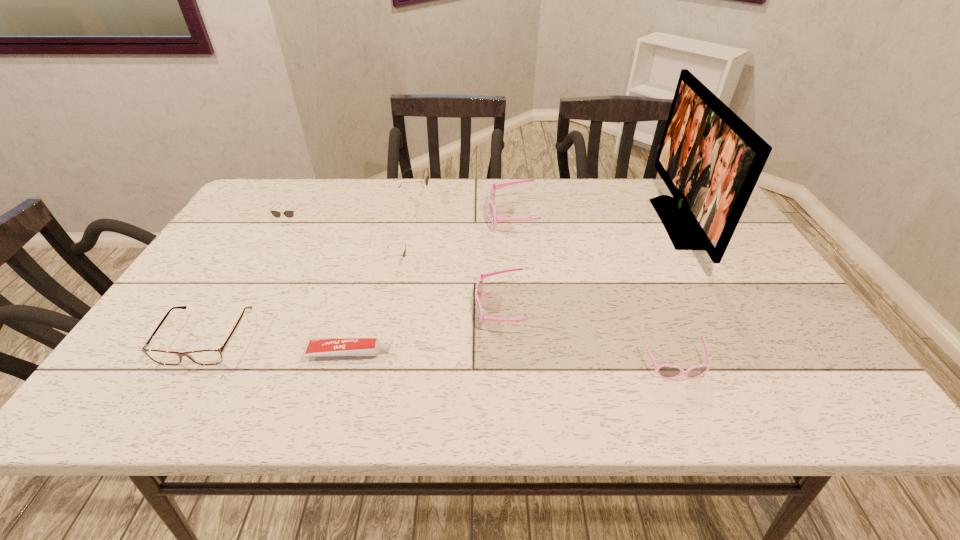
Find the location of `the fourth farthest sunglasses`. the fourth farthest sunglasses is located at coordinates (404, 253).

Identify the location of red spectacles. tap(211, 356).

Locate an element on the screen. Image resolution: width=960 pixels, height=540 pixels. the eighth object from left to right is located at coordinates (666, 371).

Where is `the rightmost pink sunglasses`? This screenshot has height=540, width=960. the rightmost pink sunglasses is located at coordinates (666, 371).

Find the location of a particular element. The image size is (960, 540). toothpaste is located at coordinates (315, 347).

Identify the location of vacant space located 0.310m on the front-facing side of the rightmost object. The image size is (960, 540). (556, 223).

Locate an element on the screen. The image size is (960, 540). vacant space positioned on the front-facing side of the rightmost object is located at coordinates (549, 223).

Find the location of a particular element. vacant region located 0.200m on the front-facing side of the rightmost object is located at coordinates (593, 223).

Where is `free space located 0.270m in front of the lenses of the tallest sunglasses`? free space located 0.270m in front of the lenses of the tallest sunglasses is located at coordinates 516,197.

The width and height of the screenshot is (960, 540). I want to click on blank area located on the front-facing side of the farthest pink sunglasses, so click(x=444, y=218).